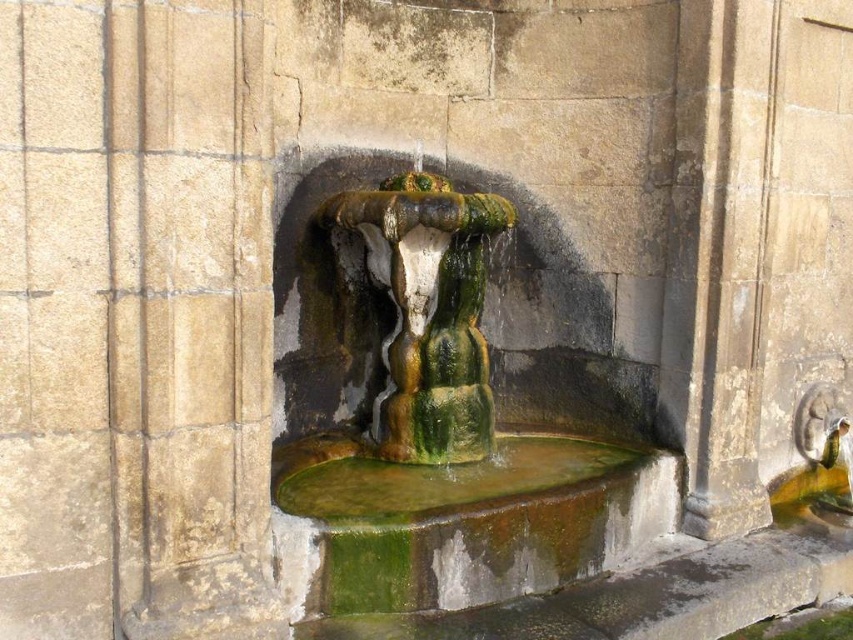
You are standing in front of the fountain and notice a point marked at coordinates (722, 250). Based on the scene description, what object is located at this point?

The point at (722, 250) marks the location of the smooth stone pillar at right.

You are a maintenance worker tasked with cleaning the fountain. You have a 24 inch long cleaning tool. Can you reach the smooth stone pillar at right from the green mossy water at center with your tool?

The distance between the smooth stone pillar at right and the green mossy water at center is 24.39 inches. Since your tool is 24 inches long, it is slightly shorter than the required distance. You cannot reach the smooth stone pillar at right from the green mossy water at center with your current tool.